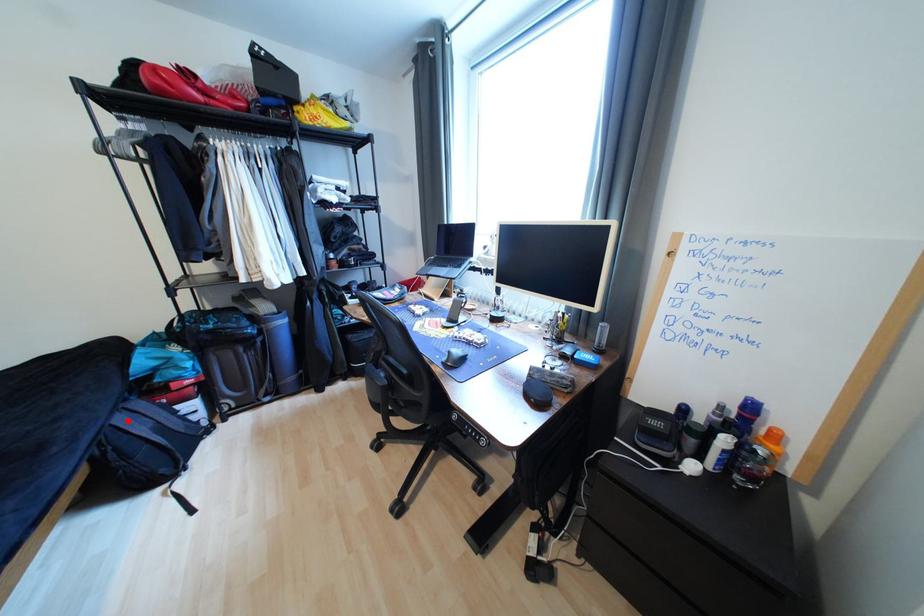
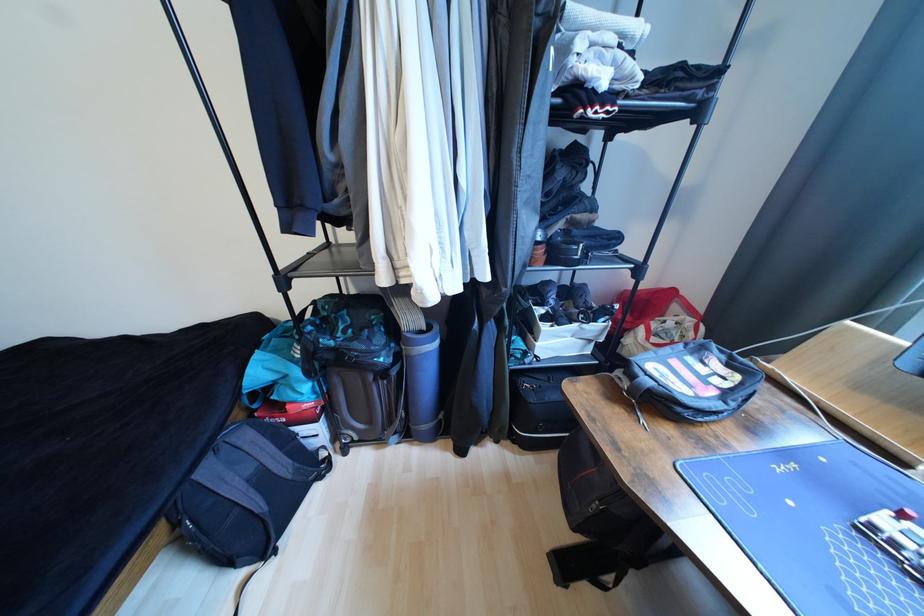
Question: I am providing you with two images of the same scene from different viewpoints. In image1, a red point is highlighted. Considering the same 3D point in image2, which of the following is correct?

Choices:
 (A) It is closer
 (B) It is farther

Answer: (A)